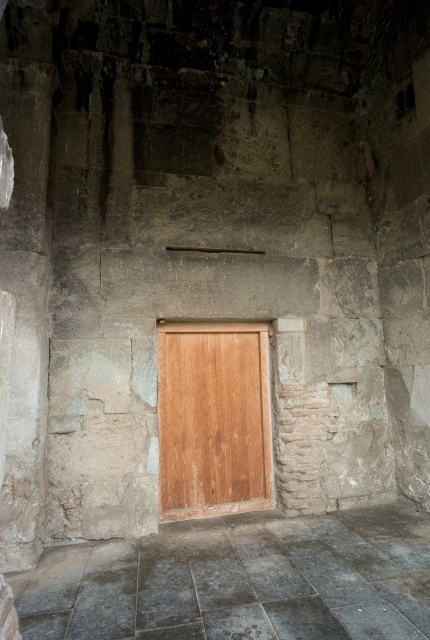
You are a delivery person trying to determine if a tall package can fit through the wooden door at center. The package is as tall as the smooth stone floor at center. Will the package fit through the door?

The smooth stone floor at center is not as tall as the wooden door at center, so the package, which is as tall as the smooth stone floor at center, will fit through the door.

From the picture: You are an interior designer planning to place a large rug in the center of the room. Given the sizes of the smooth stone floor at center and the wooden door at center, which object should the rug be placed over to ensure it covers the larger area?

The smooth stone floor at center is bigger than the wooden door at center, so the rug should be placed over the smooth stone floor at center to cover the larger area.

You are standing in a room with weathered stone walls and a wooden door. You need to place a 3.5 feet long wooden bench on the smooth stone floor at center. Will the bench fit on the floor without extending beyond its edges?

The smooth stone floor at center is 8.73 feet from viewer. Since the bench is only 3.5 feet long, it will fit comfortably on the floor without extending beyond its edges.